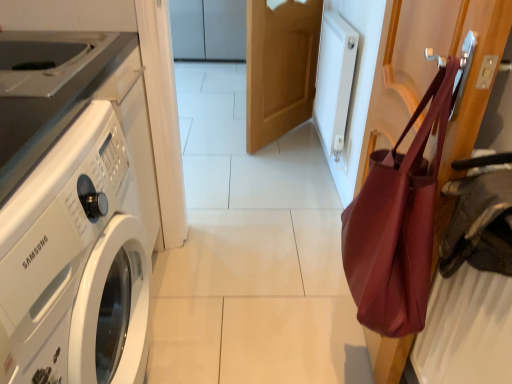
Locate an element on the screen. free space in front of light brown wood door at center is located at coordinates (279, 162).